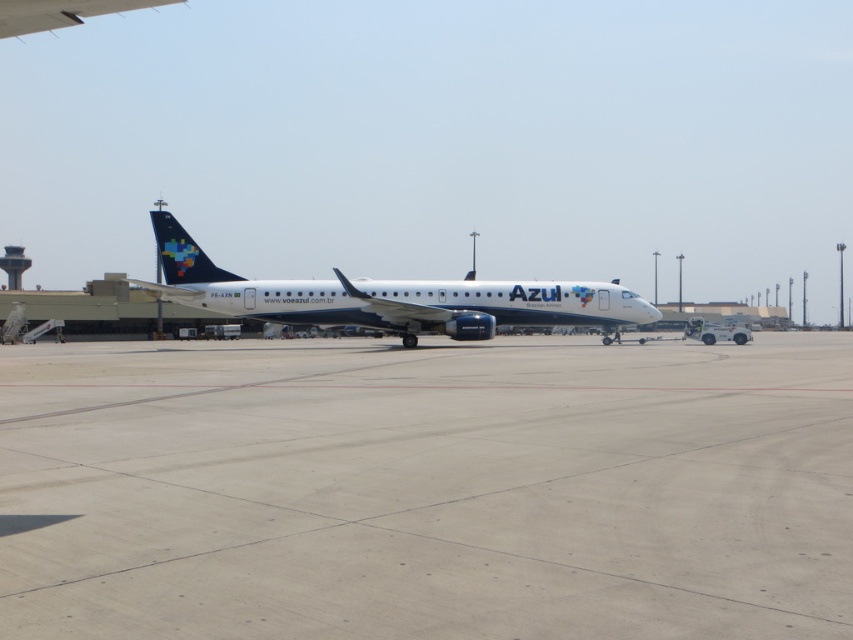
Based on the photo, you are a ground crew member and need to inspect the area where the white glossy airplane at center is parked. Since the smooth concrete tarmac at center is under the airplane, can you walk directly underneath the airplane without stepping on the tarmac?

The smooth concrete tarmac at center is positioned under the white glossy airplane at center, so you cannot walk directly underneath the airplane without stepping on the tarmac because the tarmac is the surface beneath it.

You are a pilot standing on the smooth concrete tarmac at center. You need to board the white glossy airplane at center. Which direction should you walk to reach the airplane?

The smooth concrete tarmac at center is not as tall as the white glossy airplane at center, so you should walk towards the airplane in the direction where the airplane is taller than the tarmac.

You are standing on the airport tarmac and see the smooth concrete tarmac at center and the white glossy airplane at center. Which object is located to the left of the other?

The smooth concrete tarmac at center is located to the left of the white glossy airplane at center.